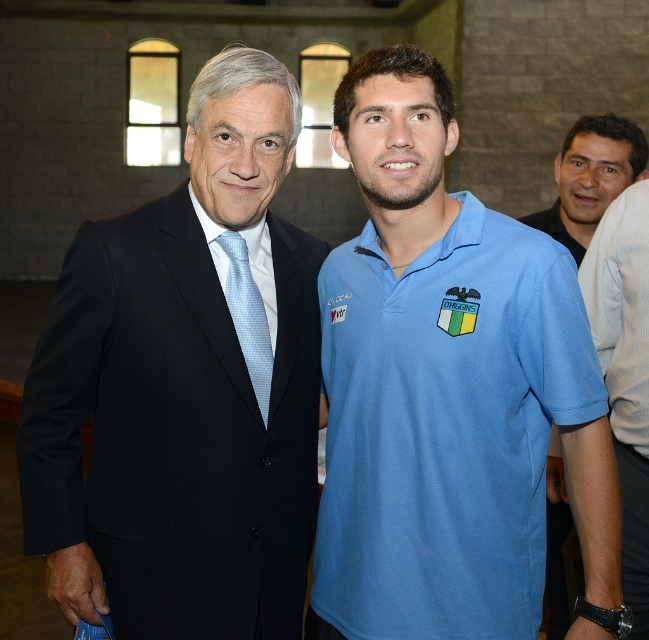
Question: Which object is farther from the camera taking this photo?

Choices:
 (A) blue cotton polo shirt at center
 (B) matte black suit at left

Answer: (A)

Question: Which object is closer to the camera taking this photo?

Choices:
 (A) blue fabric shirt at right
 (B) light blue silk tie at center
 (C) blue cotton polo shirt at center
 (D) light blue cotton polo shirt at center

Answer: (D)

Question: Is light blue cotton polo shirt at center above blue cotton polo shirt at center?

Choices:
 (A) yes
 (B) no

Answer: (B)

Question: Among these objects, which one is farthest from the camera?

Choices:
 (A) blue cotton polo shirt at center
 (B) matte black suit at left

Answer: (A)

Question: Does matte black suit at left appear under smooth black shirt at right?

Choices:
 (A) yes
 (B) no

Answer: (A)

Question: Is matte black suit at left closer to camera compared to light blue silk tie at center?

Choices:
 (A) no
 (B) yes

Answer: (B)